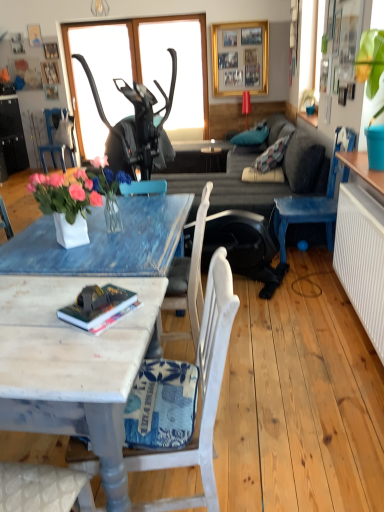
Question: Could you tell me if gold metallic picture frame at upper center is facing blue painted wood chair at left, the third chair when ordered from bottom to top?

Choices:
 (A) no
 (B) yes

Answer: (A)

Question: Is gold metallic picture frame at upper center oriented away from blue painted wood chair at left, the third chair when ordered from bottom to top?

Choices:
 (A) no
 (B) yes

Answer: (A)

Question: Could blue painted wood chair at left, the third chair when ordered from bottom to top, be considered to be inside gold metallic picture frame at upper center?

Choices:
 (A) yes
 (B) no

Answer: (B)

Question: Does gold metallic picture frame at upper center have a greater height compared to blue painted wood chair at left, the third chair viewed from the front?

Choices:
 (A) no
 (B) yes

Answer: (B)

Question: Does gold metallic picture frame at upper center touch blue painted wood chair at left, the 1th chair in the back-to-front sequence?

Choices:
 (A) no
 (B) yes

Answer: (A)

Question: Choose the correct answer: Is blue painted wood chair at left, the third chair viewed from the front, inside hardcover book at center or outside it?

Choices:
 (A) inside
 (B) outside

Answer: (B)

Question: Is blue painted wood chair at left, the third chair viewed from the front, in front of or behind hardcover book at center in the image?

Choices:
 (A) behind
 (B) front

Answer: (A)

Question: In the image, is blue painted wood chair at left, which ranks as the third chair in right-to-left order, on the left side or the right side of hardcover book at center?

Choices:
 (A) right
 (B) left

Answer: (B)

Question: From a real-world perspective, relative to hardcover book at center, is blue painted wood chair at left, acting as the 1th chair starting from the top, vertically above or below?

Choices:
 (A) below
 (B) above

Answer: (A)

Question: Is white painted wood chair at lower center, which is the 1th chair in bottom-to-top order, in front of or behind wooden marble coffee table at lower left in the image?

Choices:
 (A) behind
 (B) front

Answer: (A)

Question: From a real-world perspective, is white painted wood chair at lower center, which is the 1th chair in bottom-to-top order, above or below wooden marble coffee table at lower left?

Choices:
 (A) above
 (B) below

Answer: (A)

Question: From the image's perspective, is white painted wood chair at lower center, the first chair from the front, above or below wooden marble coffee table at lower left?

Choices:
 (A) above
 (B) below

Answer: (A)

Question: Considering the positions of white painted wood chair at lower center, which is the third chair from top to bottom, and wooden marble coffee table at lower left in the image, is white painted wood chair at lower center, which is the third chair from top to bottom, bigger or smaller than wooden marble coffee table at lower left?

Choices:
 (A) big
 (B) small

Answer: (B)

Question: Based on their sizes in the image, would you say wooden marble coffee table at lower left is bigger or smaller than white ceramic vase at center?

Choices:
 (A) big
 (B) small

Answer: (A)

Question: Considering their positions, is wooden marble coffee table at lower left located in front of or behind white ceramic vase at center?

Choices:
 (A) front
 (B) behind

Answer: (A)